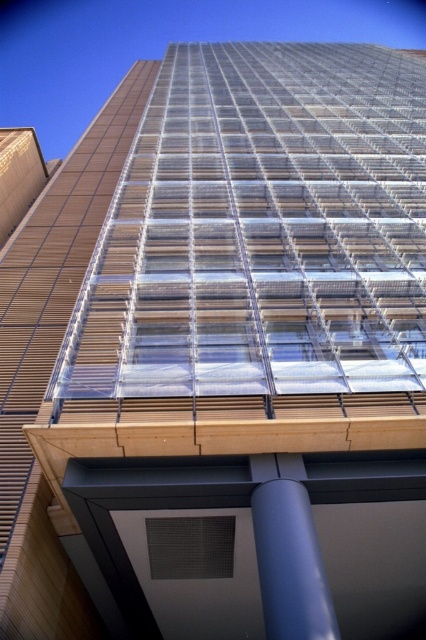
Based on the photo, is blue matte/finish pillar at lower center bigger than black mesh panel at lower center?

Yes.

Is blue matte/finish pillar at lower center wider than black mesh panel at lower center?

Incorrect, blue matte/finish pillar at lower center's width does not surpass black mesh panel at lower center's.

You are a GUI agent. You are given a task and a screenshot of the screen. Output one action in this format:
    pyautogui.click(x=<x>, y=<y>)
    Task: Click on the blue matte/finish pillar at lower center
    This screenshot has width=426, height=640.
    Given the screenshot: What is the action you would take?
    pyautogui.click(x=288, y=552)